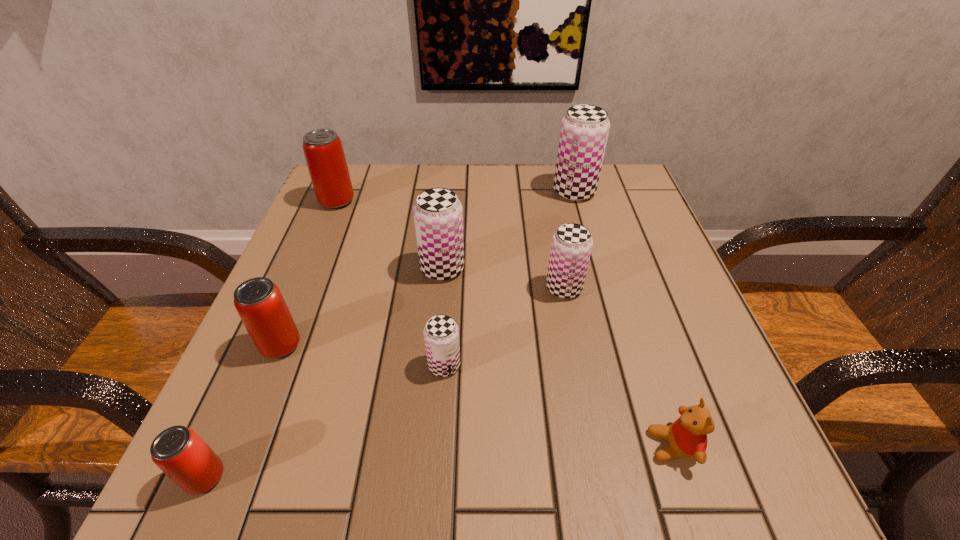
The height and width of the screenshot is (540, 960). I want to click on vacant space positioned 0.110m on the front of the tallest beer can, so click(x=586, y=233).

Where is `vacant space located 0.270m on the right of the biggest pink beer can`? The height and width of the screenshot is (540, 960). vacant space located 0.270m on the right of the biggest pink beer can is located at coordinates (468, 201).

Image resolution: width=960 pixels, height=540 pixels. Identify the location of blank area located 0.250m on the right of the second biggest purple beer can. (590, 268).

The width and height of the screenshot is (960, 540). Identify the location of vacant area situated 0.340m on the front of the third biggest purple beer can. (604, 495).

Locate an element on the screen. vacant area situated 0.180m on the front of the second nearest pink beer can is located at coordinates (228, 475).

Where is `free location located 0.300m on the left of the nearest purple beer can`? This screenshot has width=960, height=540. free location located 0.300m on the left of the nearest purple beer can is located at coordinates (242, 365).

Locate an element on the screen. This screenshot has height=540, width=960. blank area located 0.210m on the right of the smallest pink beer can is located at coordinates point(383,477).

The image size is (960, 540). In order to click on free space located 0.390m on the front-facing side of the teddy bear in this screenshot , I will do `click(371, 446)`.

Locate an element on the screen. vacant region located 0.210m on the front-facing side of the teddy bear is located at coordinates (499, 446).

Identify the location of free region located on the front-facing side of the teddy bear. This screenshot has height=540, width=960. coord(385,446).